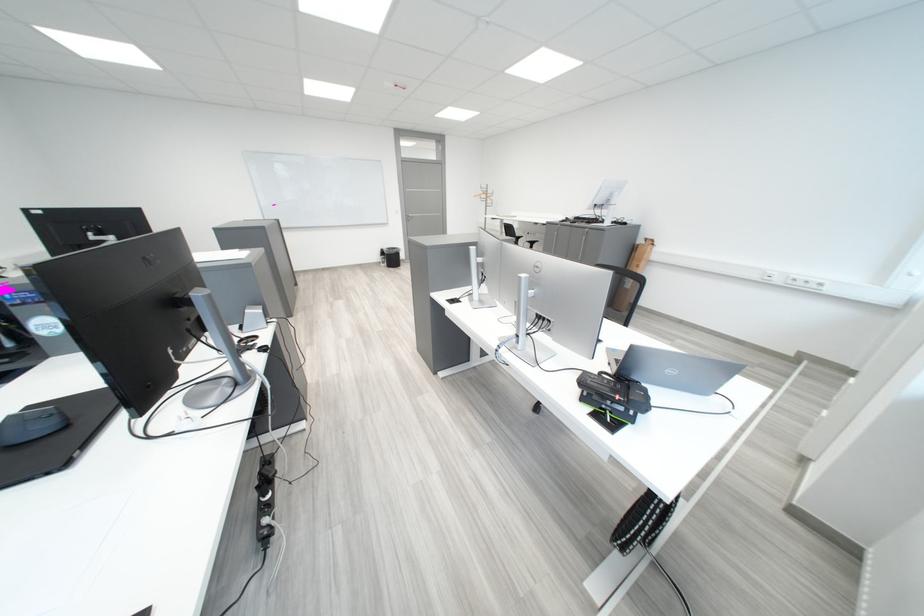
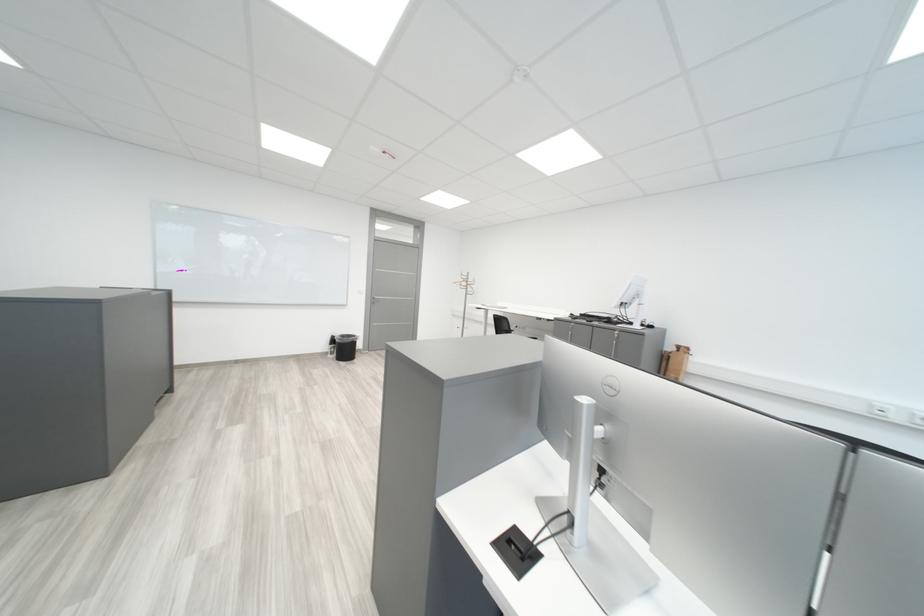
The point at (590, 220) is marked in the first image. Where is the corresponding point in the second image?

(598, 317)